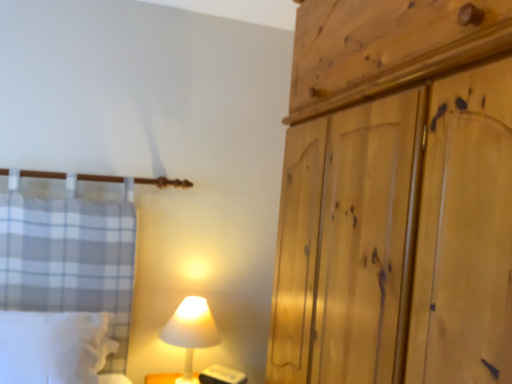
Question: Can you confirm if white soft pillow at lower left is positioned to the right of white matte lamp at lower center?

Choices:
 (A) no
 (B) yes

Answer: (A)

Question: Is white matte lamp at lower center at the back of white soft pillow at lower left?

Choices:
 (A) yes
 (B) no

Answer: (B)

Question: From a real-world perspective, is white soft pillow at lower left located beneath white matte lamp at lower center?

Choices:
 (A) yes
 (B) no

Answer: (B)

Question: Considering the relative sizes of white soft pillow at lower left and white matte lamp at lower center in the image provided, is white soft pillow at lower left thinner than white matte lamp at lower center?

Choices:
 (A) yes
 (B) no

Answer: (B)

Question: From the image's perspective, is white soft pillow at lower left located above white matte lamp at lower center?

Choices:
 (A) yes
 (B) no

Answer: (A)

Question: Is white soft pillow at lower left not close to white matte lamp at lower center?

Choices:
 (A) no
 (B) yes

Answer: (A)

Question: Does natural wood wardrobe at right have a larger size compared to white matte lamp at lower center?

Choices:
 (A) no
 (B) yes

Answer: (B)

Question: Is natural wood wardrobe at right looking in the opposite direction of white matte lamp at lower center?

Choices:
 (A) yes
 (B) no

Answer: (B)

Question: Would you say natural wood wardrobe at right is a long distance from white matte lamp at lower center?

Choices:
 (A) yes
 (B) no

Answer: (B)

Question: From a real-world perspective, is natural wood wardrobe at right beneath white matte lamp at lower center?

Choices:
 (A) yes
 (B) no

Answer: (B)

Question: Does natural wood wardrobe at right touch white matte lamp at lower center?

Choices:
 (A) yes
 (B) no

Answer: (B)

Question: Is white matte lamp at lower center a part of natural wood wardrobe at right?

Choices:
 (A) no
 (B) yes

Answer: (A)

Question: Can you confirm if white matte lamp at lower center is shorter than natural wood wardrobe at right?

Choices:
 (A) no
 (B) yes

Answer: (B)